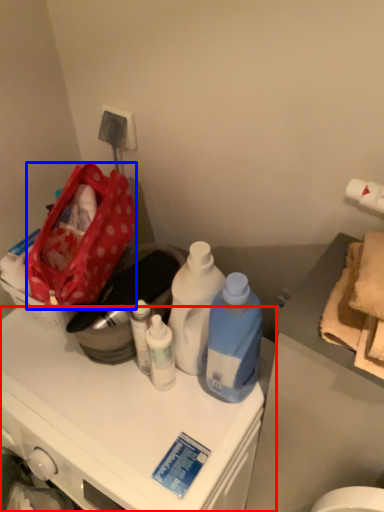
Question: Which point is closer to the camera, cabinetry (highlighted by a red box) or handbag (highlighted by a blue box)?

Choices:
 (A) cabinetry
 (B) handbag

Answer: (A)